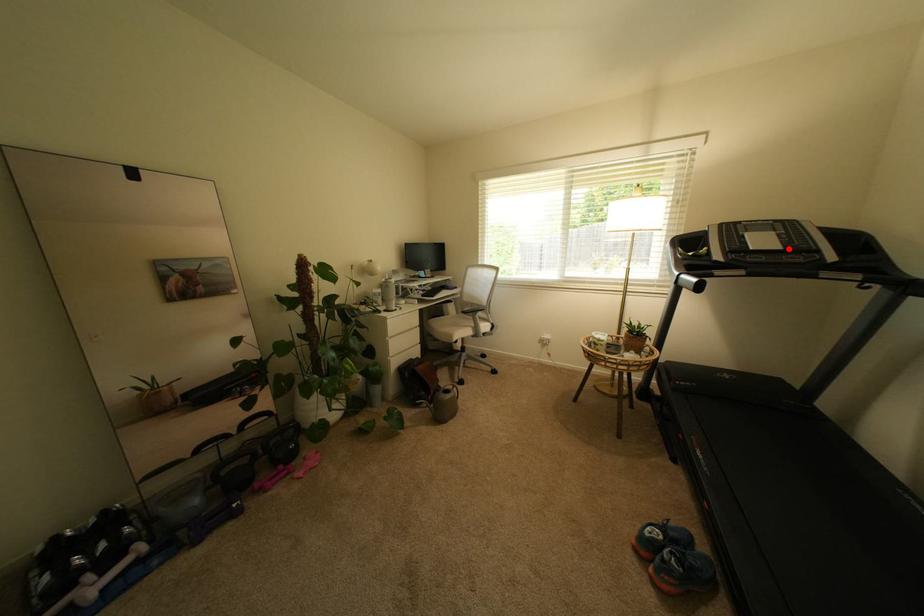
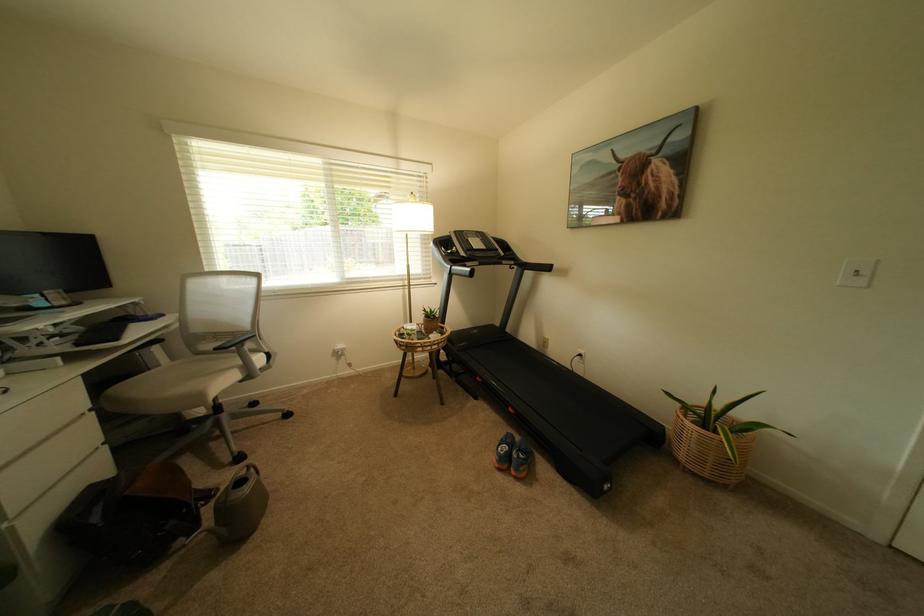
Question: I am providing you with two images of the same scene from different viewpoints. In image1, a red point is highlighted. Considering the same 3D point in image2, which of the following is correct?

Choices:
 (A) It is closer
 (B) It is farther

Answer: (A)